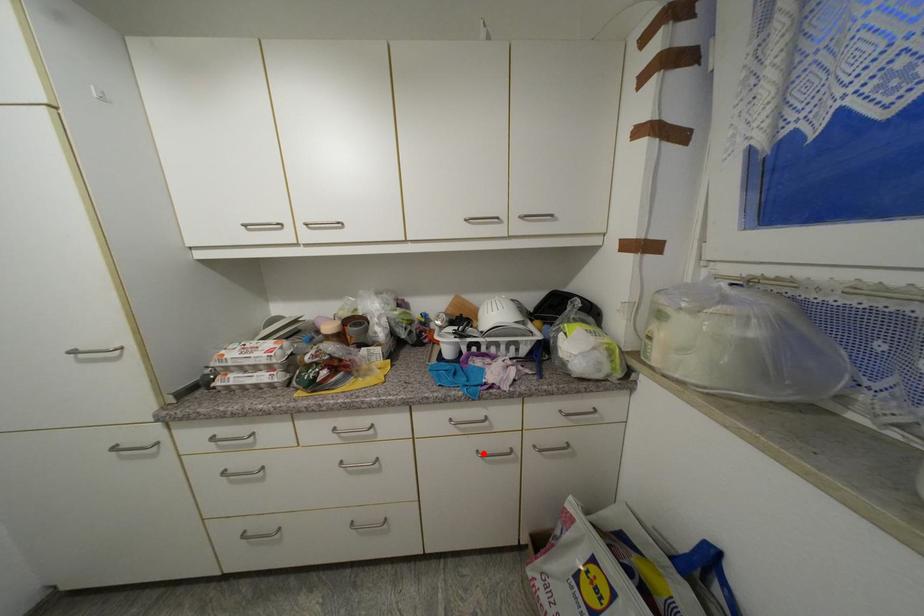
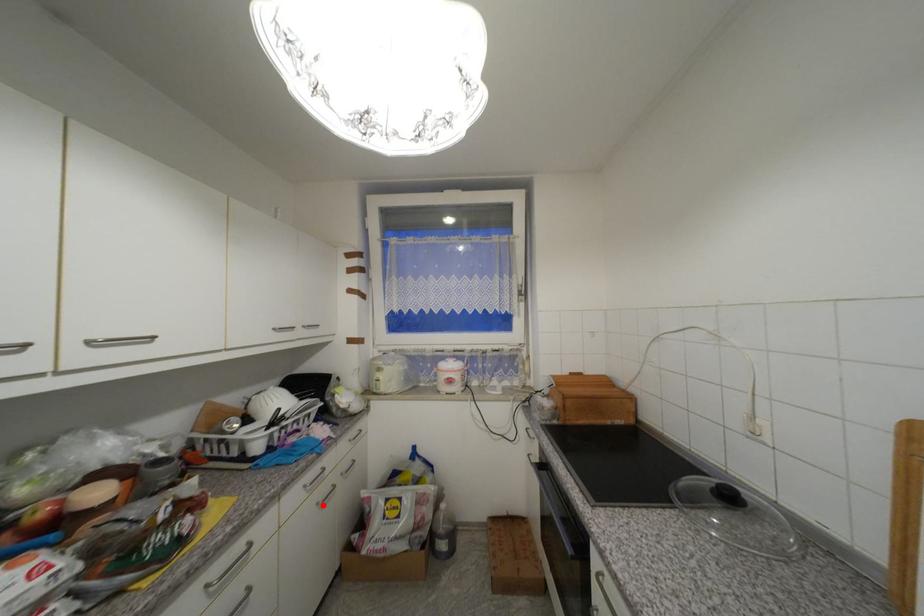
I am providing you with two images of the same scene from different viewpoints. A red point is marked on the first image and another point is marked on the second image. Is the red point in image1 aligned with the point shown in image2?

Yes